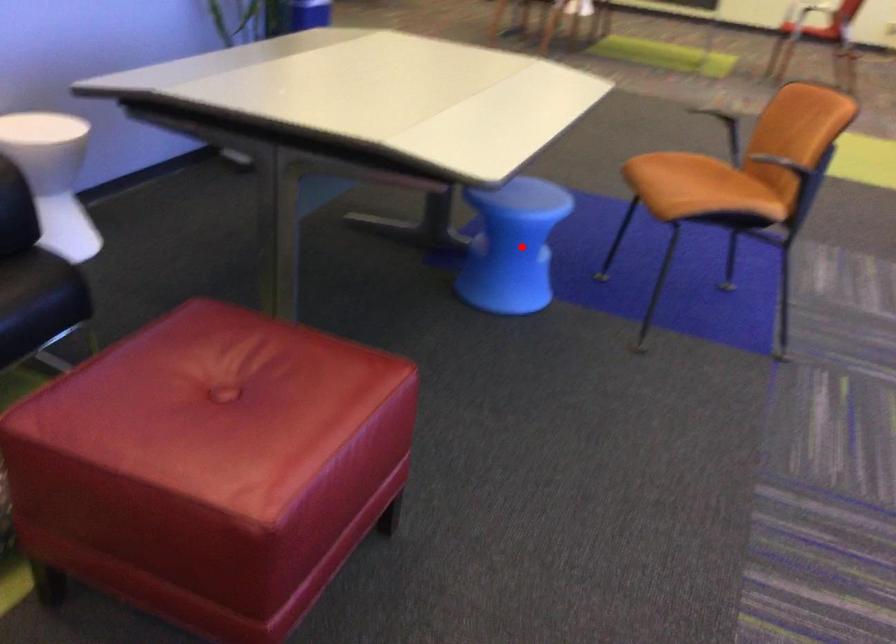
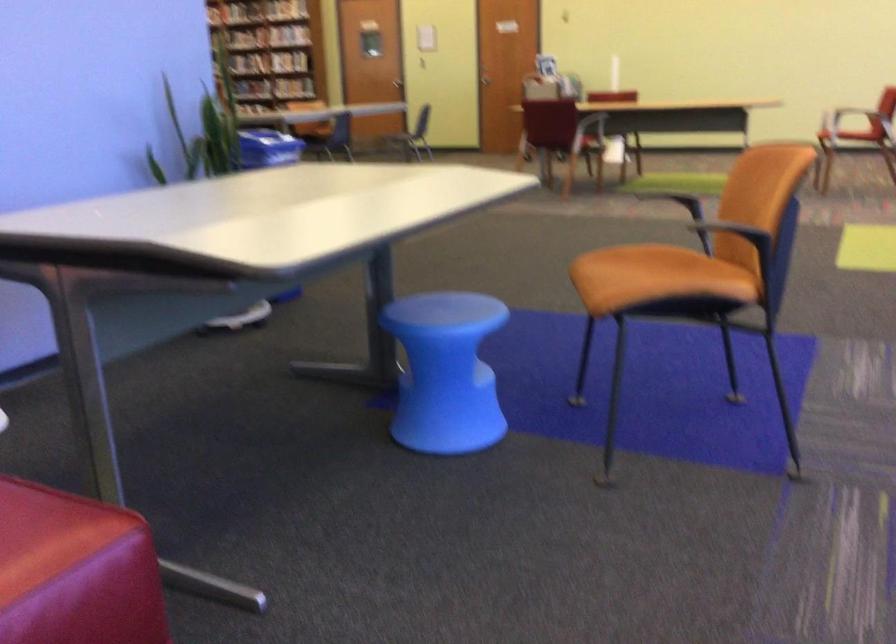
Locate, in the second image, the point that corresponds to the highlighted location in the first image.

(445, 372)